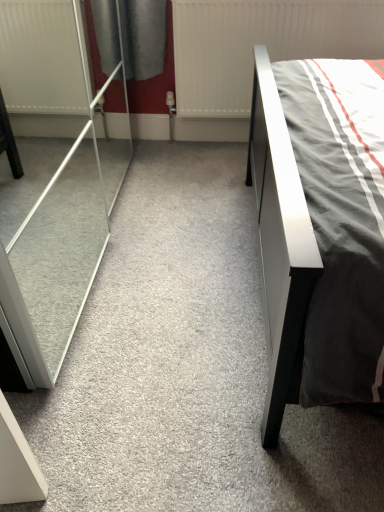
At what (x,y) coordinates should I click in order to perform the action: click on vacant region to the right of transparent glass screen door at left. Please return your answer as a coordinate pair (x, y). The height and width of the screenshot is (512, 384). Looking at the image, I should click on (190, 251).